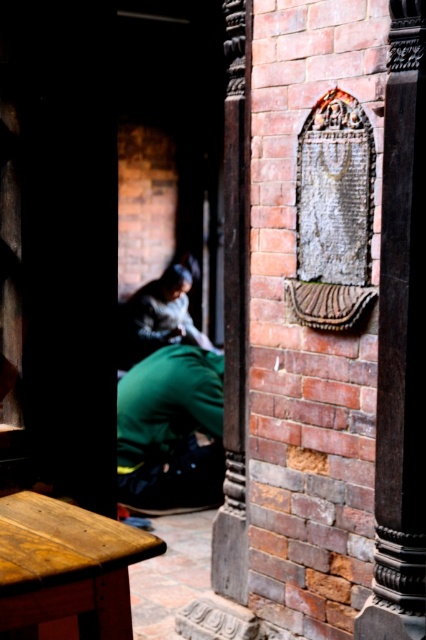
Question: Can you confirm if smooth stone pillar at center is positioned below green fabric squat at lower left?

Choices:
 (A) yes
 (B) no

Answer: (B)

Question: Is smooth stone pillar at center behind green fabric at lower left?

Choices:
 (A) yes
 (B) no

Answer: (B)

Question: Which object is the closest to the green fabric at lower left?

Choices:
 (A) green fabric squat at lower left
 (B) wooden stool at lower left
 (C) smooth stone pillar at center
 (D) dark brown wood pillar at center

Answer: (A)

Question: Is dark brown wood pillar at center to the right of green fabric at lower left from the viewer's perspective?

Choices:
 (A) no
 (B) yes

Answer: (B)

Question: Which object appears closest to the camera in this image?

Choices:
 (A) green fabric squat at lower left
 (B) wooden stool at lower left
 (C) green fabric at lower left
 (D) dark brown wood pillar at center

Answer: (B)

Question: Considering the real-world distances, which object is farthest from the wooden stool at lower left?

Choices:
 (A) green fabric squat at lower left
 (B) dark brown wood pillar at center
 (C) smooth stone pillar at center

Answer: (A)